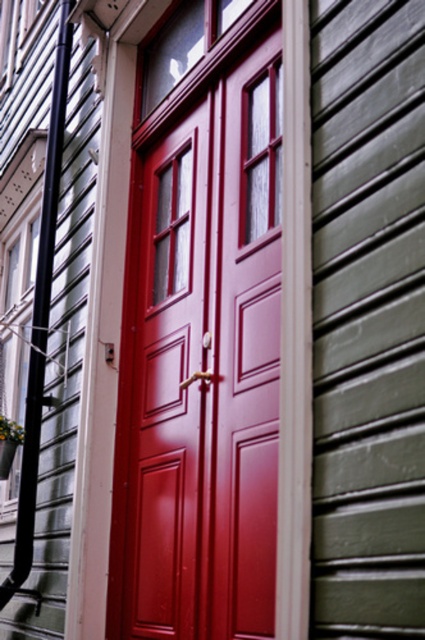
You are standing in front of the red door and want to touch both the green painted wood siding at right and the black plastic pipe at left. Which object will you reach first?

The green painted wood siding at right is closer to the viewer than the black plastic pipe at left, so you will reach the green painted wood siding at right first.

You are a painter standing 5 feet away from the glossy wood door at center. You need to paint the green painted wood siding at right. Can you reach it without moving closer?

The glossy wood door at center is 3.34 feet away from the green painted wood siding at right. Since you are already 5 feet away from the glossy wood door at center, the distance to the green painted wood siding at right would be 5 feet plus 3.34 feet, totaling 8.34 feet. This distance is likely too far for a painter to reach without moving closer.

You are a painter who needs to know which object is wider to choose the right brush size. Given the glossy wood door at center and the black plastic pipe at left in the image, which one has a greater width?

The glossy wood door at center has a greater width than the black plastic pipe at left.